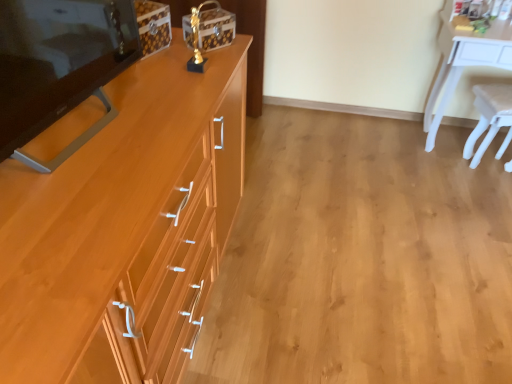
Identify the location of free space that is to the left of white plastic chair at right. The height and width of the screenshot is (384, 512). (440, 171).